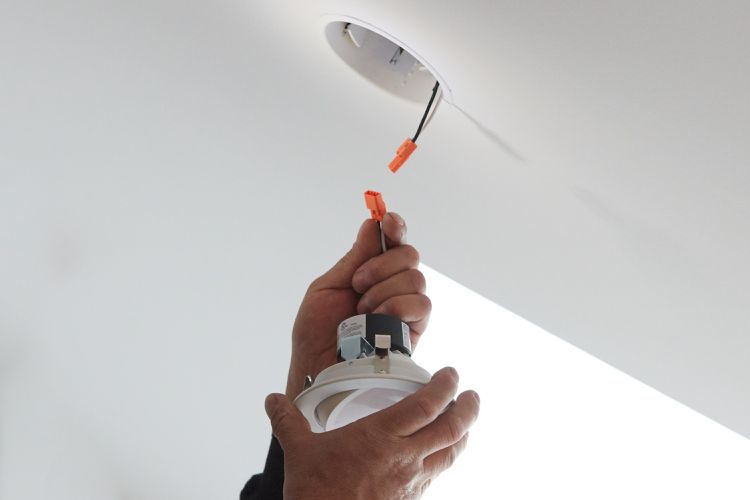
Where is `ceiling`? ceiling is located at coordinates (590, 271).